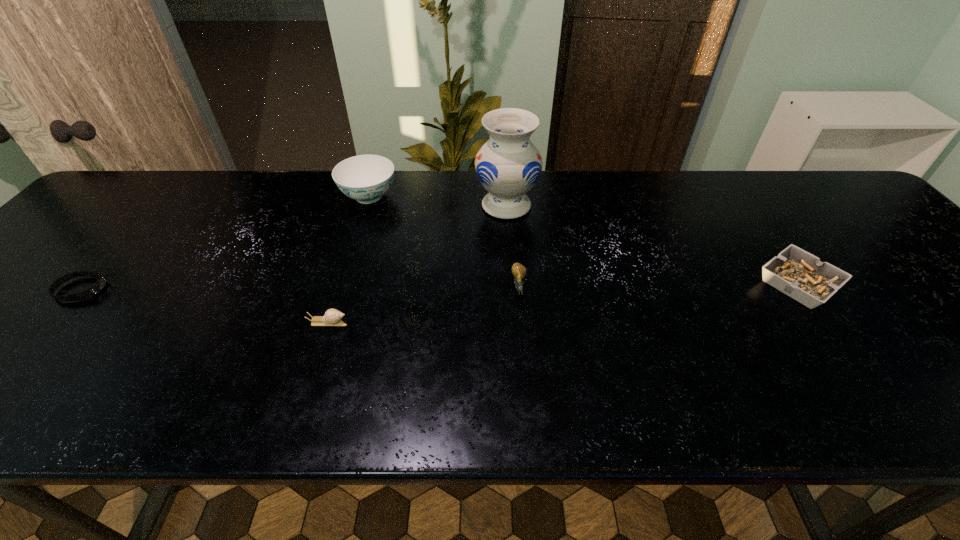
Image resolution: width=960 pixels, height=540 pixels. I want to click on free point located on the right of the chinaware, so click(x=419, y=197).

Identify the location of free space located 0.270m on the front-facing side of the farther escargot. (530, 410).

Locate an element on the screen. This screenshot has width=960, height=540. free location located on the right of the ashtray is located at coordinates (929, 284).

This screenshot has height=540, width=960. Identify the location of vacant space located 0.220m on the shell of the nearer escargot. (450, 322).

Find the location of a particular element. Image resolution: width=960 pixels, height=540 pixels. vacant space located 0.210m on the display of the shortest object is located at coordinates (196, 289).

The width and height of the screenshot is (960, 540). I want to click on vase that is at the far edge, so click(x=508, y=165).

Where is `chinaware located in the far edge section of the desktop`? The image size is (960, 540). chinaware located in the far edge section of the desktop is located at coordinates (365, 178).

I want to click on object present at the left edge, so click(97, 287).

In the image, there is a desktop. Where is `free space at the far edge`? This screenshot has height=540, width=960. free space at the far edge is located at coordinates (417, 179).

The height and width of the screenshot is (540, 960). In order to click on free space at the near edge of the desktop in this screenshot , I will do `click(809, 409)`.